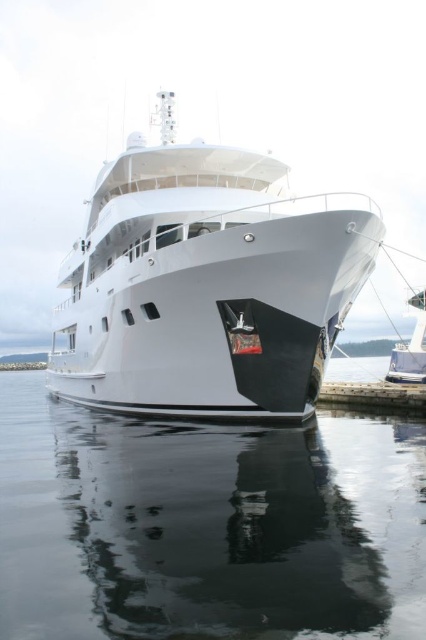
You are standing on the dock and see the transparent water at lower center and the white glossy yacht at right. Which object is closer to you?

The transparent water at lower center is closer to you because it is in front of the white glossy yacht at right.

You are standing on the yacht and looking towards the marina. There are two points marked on the yacht, one at point (367,502) and another at point (423,323). Which point is closer to you?

Point (367,502) is in front of point (423,323), so the point closer to you is point (367,502).

You are standing on the dock and see the transparent water at lower center and the white glossy yacht at right. Which object is positioned to the left of the other?

The transparent water at lower center is to the left of the white glossy yacht at right.